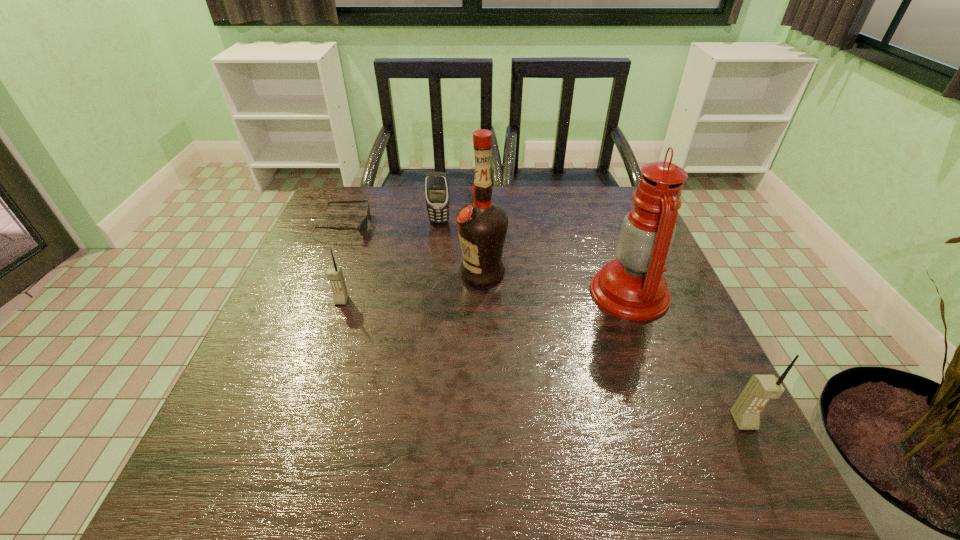
I want to click on object that stands as the fourth closest to the leftmost cellular telephone, so click(632, 287).

I want to click on object that ranks as the fourth closest to the third object from right to left, so click(x=362, y=228).

In order to click on the closest cellular telephone to the nearest object in this screenshot , I will do 436,183.

The image size is (960, 540). Find the location of `the second closest cellular telephone to the leftmost cellular telephone`. the second closest cellular telephone to the leftmost cellular telephone is located at coordinates (760, 389).

The height and width of the screenshot is (540, 960). I want to click on free spot that satisfies the following two spatial constraints: 1. on the front face of the fourth object from right to left; 2. on the lenses of the shortest object, so click(x=439, y=226).

This screenshot has width=960, height=540. In order to click on free point that satisfies the following two spatial constraints: 1. on the front and back of the third object from right to left; 2. on the front of the second farthest cellular telephone, where the keypad is located in this screenshot , I will do `click(483, 300)`.

You are a GUI agent. You are given a task and a screenshot of the screen. Output one action in this format:
    pyautogui.click(x=<x>, y=<y>)
    Task: Click on the free region that satisfies the following two spatial constraints: 1. on the lenses of the oil lamp; 2. on the left side of the shortest object
    
    Given the screenshot: What is the action you would take?
    pyautogui.click(x=316, y=293)